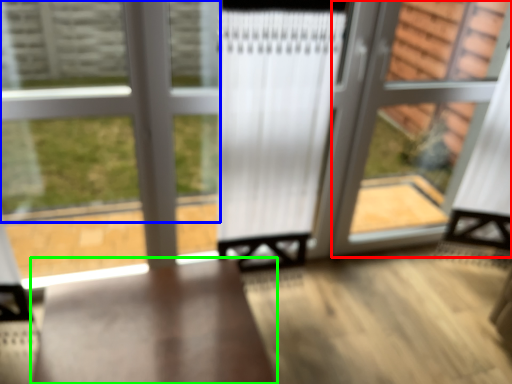
Question: Which object is positioned closest to screen door (highlighted by a red box)? Select from bay window (highlighted by a blue box) and furniture (highlighted by a green box).

Choices:
 (A) bay window
 (B) furniture

Answer: (A)